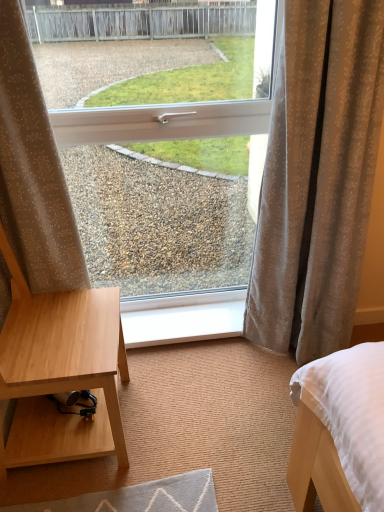
Question: Is white plastic window at center inside beige textured curtain at right, which appears as the 2th curtain when viewed from the left?

Choices:
 (A) no
 (B) yes

Answer: (A)

Question: Can you confirm if beige textured curtain at right, acting as the first curtain starting from the right, is thinner than white plastic window at center?

Choices:
 (A) yes
 (B) no

Answer: (B)

Question: Can you confirm if beige textured curtain at right, which appears as the 2th curtain when viewed from the left, is wider than white plastic window at center?

Choices:
 (A) yes
 (B) no

Answer: (A)

Question: Does beige textured curtain at right, acting as the first curtain starting from the right, lie behind white plastic window at center?

Choices:
 (A) yes
 (B) no

Answer: (B)

Question: From the image's perspective, is beige textured curtain at right, which appears as the 2th curtain when viewed from the left, above white plastic window at center?

Choices:
 (A) yes
 (B) no

Answer: (B)

Question: Considering their positions, is white plastic window sill at center located in front of or behind beige dotted fabric at left, the first curtain when ordered from left to right?

Choices:
 (A) behind
 (B) front

Answer: (A)

Question: Visually, is white plastic window sill at center positioned to the left or to the right of beige dotted fabric at left, which is counted as the 2th curtain, starting from the right?

Choices:
 (A) left
 (B) right

Answer: (B)

Question: Looking at their shapes, would you say white plastic window sill at center is wider or thinner than beige dotted fabric at left, the first curtain when ordered from left to right?

Choices:
 (A) wide
 (B) thin

Answer: (A)

Question: Does point (185, 321) appear closer or farther from the camera than point (79, 250)?

Choices:
 (A) farther
 (B) closer

Answer: (A)

Question: Based on their sizes in the image, would you say white plastic window at center is bigger or smaller than beige dotted fabric at left, which is counted as the 2th curtain, starting from the right?

Choices:
 (A) small
 (B) big

Answer: (B)

Question: From their relative heights in the image, would you say white plastic window at center is taller or shorter than beige dotted fabric at left, which is counted as the 2th curtain, starting from the right?

Choices:
 (A) tall
 (B) short

Answer: (A)

Question: From the image's perspective, is white plastic window at center located above or below beige dotted fabric at left, which is counted as the 2th curtain, starting from the right?

Choices:
 (A) above
 (B) below

Answer: (A)

Question: Is point (352, 178) positioned closer to the camera than point (56, 245)?

Choices:
 (A) farther
 (B) closer

Answer: (B)

Question: From the image's perspective, is beige dotted fabric at left, the first curtain when ordered from left to right, above or below white plastic window at center?

Choices:
 (A) above
 (B) below

Answer: (B)

Question: Is point (24, 267) closer or farther from the camera than point (67, 272)?

Choices:
 (A) closer
 (B) farther

Answer: (A)